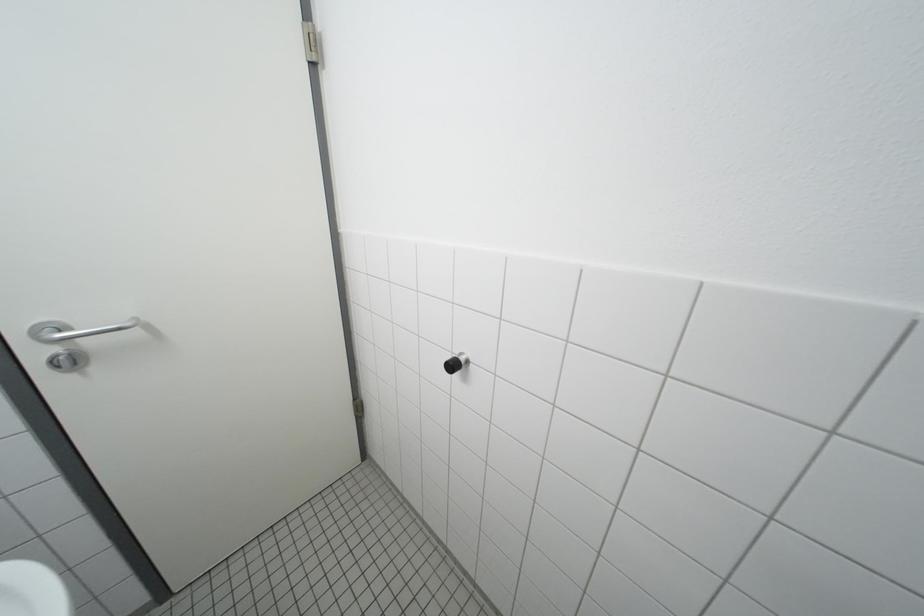
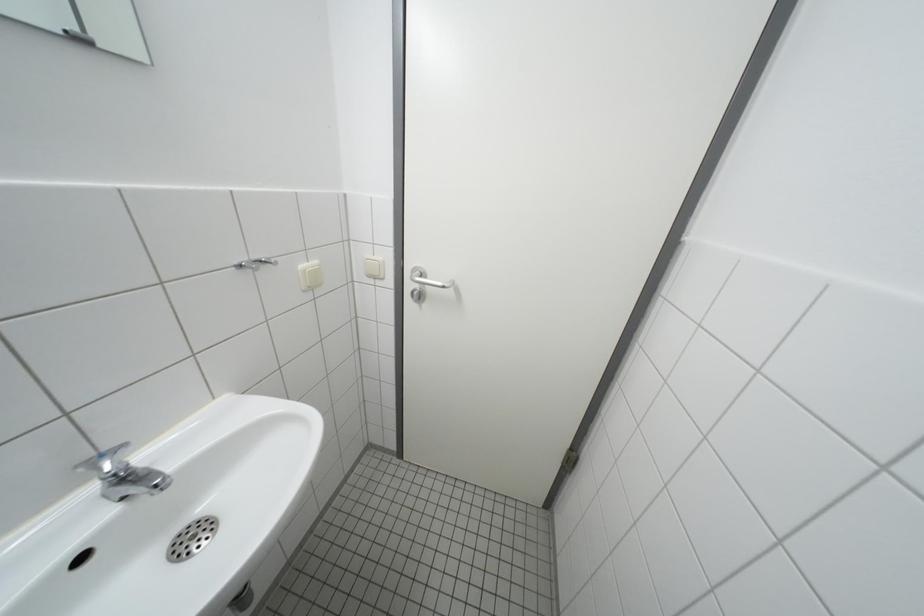
Question: The camera is either moving clockwise (left) or counter-clockwise (right) around the object. The first image is from the beginning of the video and the second image is from the end. Is the camera moving left or right when shooting the video?

Choices:
 (A) Left
 (B) Right

Answer: (B)